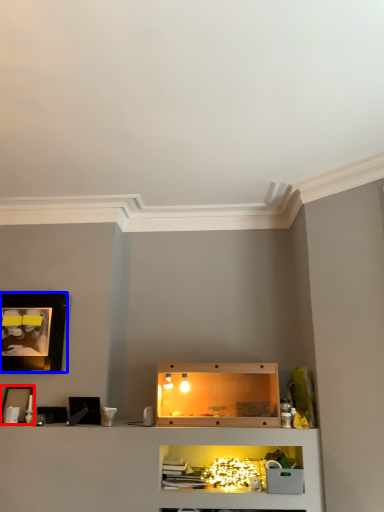
Question: Which point is further to the camera, picture frame (highlighted by a red box) or picture frame (highlighted by a blue box)?

Choices:
 (A) picture frame
 (B) picture frame

Answer: (B)